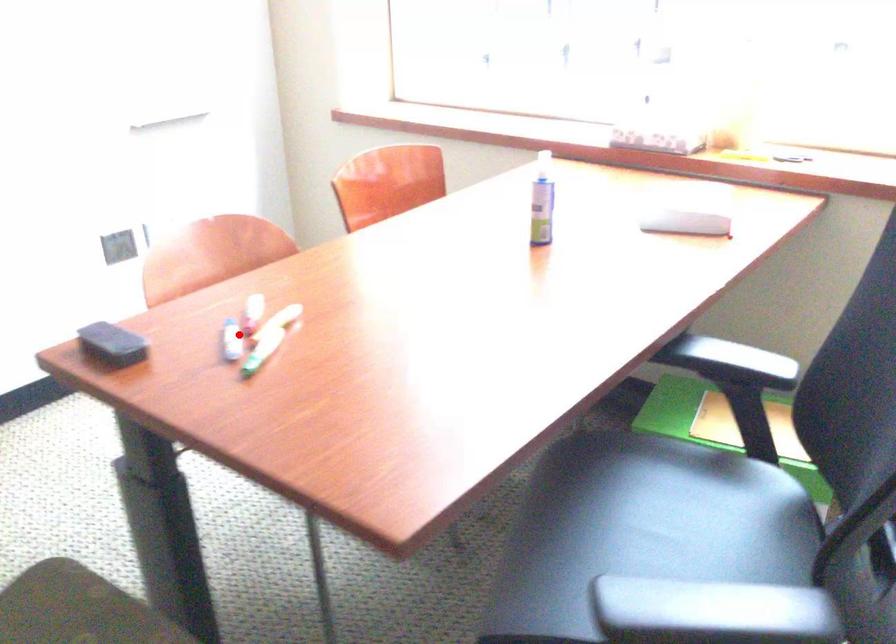
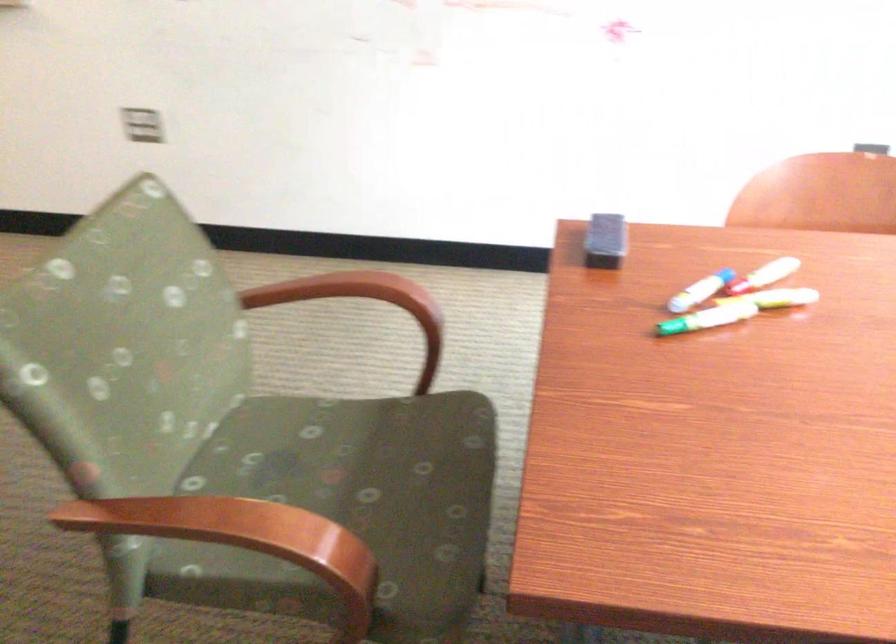
Question: I am providing you with two images of the same scene from different viewpoints. A red point is shown in image1. For the corresponding object point in image2, is it positioned nearer or farther from the camera?

Choices:
 (A) Nearer
 (B) Farther

Answer: (A)